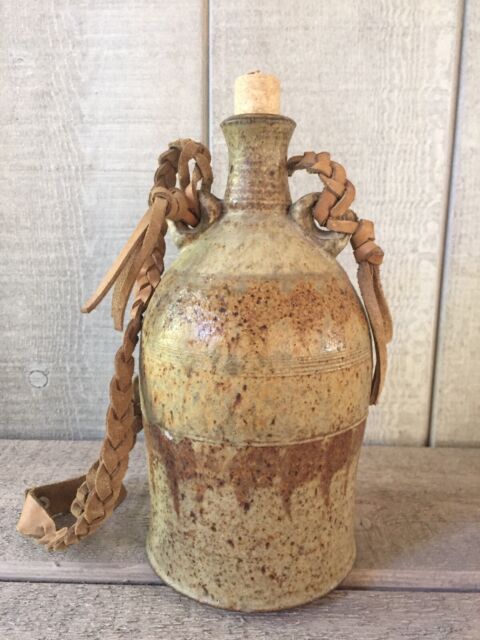
Where is `floor`? Image resolution: width=480 pixels, height=640 pixels. floor is located at coordinates (413, 570).